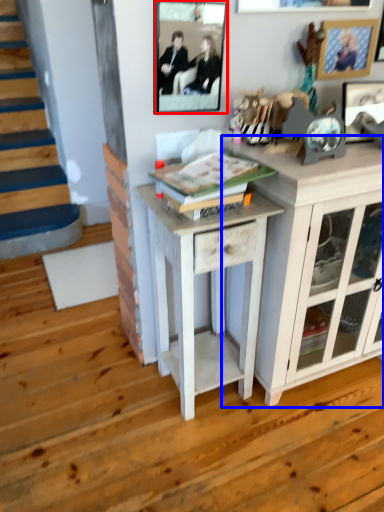
Question: Which point is further to the camera, picture frame (highlighted by a red box) or cabinetry (highlighted by a blue box)?

Choices:
 (A) picture frame
 (B) cabinetry

Answer: (A)